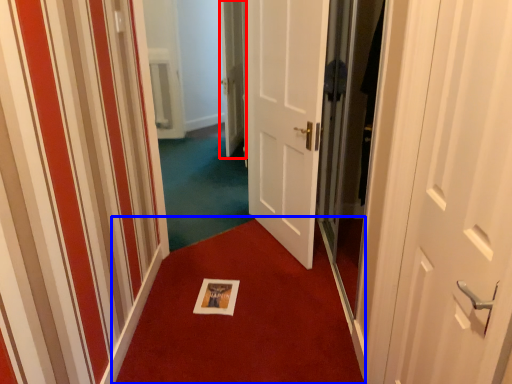
Question: Which of the following is the farthest to the observer, door (highlighted by a red box) or doormat (highlighted by a blue box)?

Choices:
 (A) door
 (B) doormat

Answer: (A)